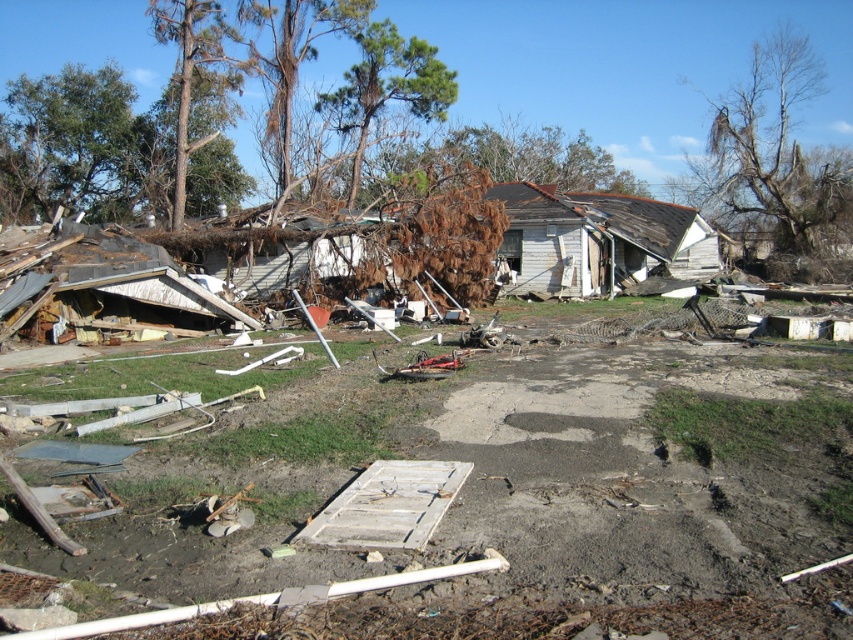
Question: Can you confirm if brown/dry wood tree at upper left is bigger than brown/dried wood tree at upper center?

Choices:
 (A) yes
 (B) no

Answer: (B)

Question: Is brown/dry wood tree at upper left below brown textured tree at upper left?

Choices:
 (A) no
 (B) yes

Answer: (A)

Question: Which point is farther to the camera?

Choices:
 (A) brown/dried wood tree at upper center
 (B) bare wood tree at upper right
 (C) brown/dry wood tree at upper left
 (D) brown textured tree at upper left

Answer: (C)

Question: Which point is closer to the camera taking this photo?

Choices:
 (A) click(206, 16)
 (B) click(22, 99)

Answer: (A)

Question: Can you confirm if brown/dried wood tree at upper center is smaller than brown textured tree at upper left?

Choices:
 (A) no
 (B) yes

Answer: (A)

Question: Which point is closer to the camera?

Choices:
 (A) brown textured tree at upper left
 (B) brown/dry wood tree at upper left

Answer: (A)